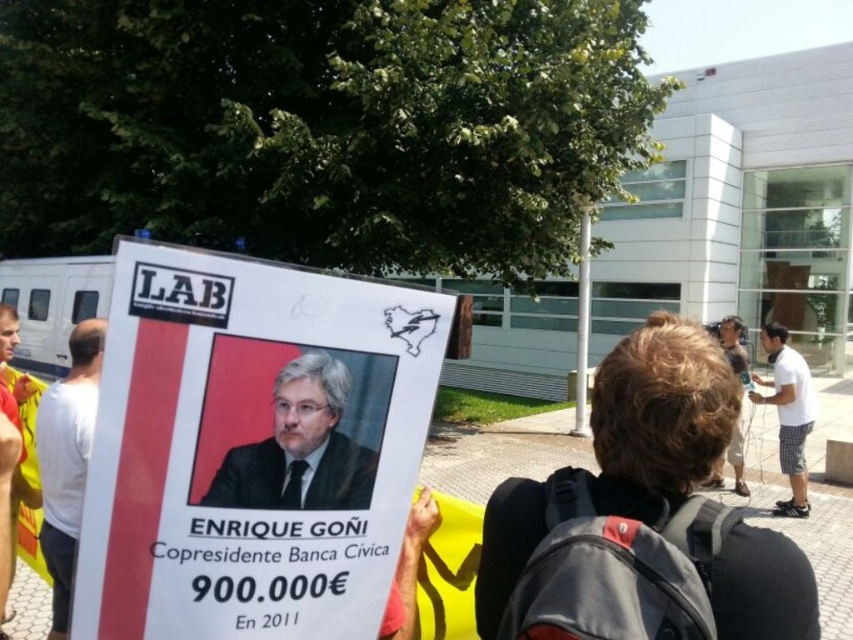
Question: Can you confirm if dark gray suit at center is positioned above white checkered shorts at lower right?

Choices:
 (A) yes
 (B) no

Answer: (A)

Question: Which object appears closest to the camera in this image?

Choices:
 (A) white t-shirt at left
 (B) white checkered shorts at lower right

Answer: (A)

Question: Does dark gray suit at center come in front of white t-shirt at left?

Choices:
 (A) yes
 (B) no

Answer: (A)

Question: Estimate the real-world distances between objects in this image. Which object is farther from the white t-shirt at left?

Choices:
 (A) dark gray suit at center
 (B) white checkered shorts at lower right

Answer: (B)

Question: Which object is the closest to the white paper poster at center?

Choices:
 (A) white t-shirt at left
 (B) dark gray suit at center

Answer: (B)

Question: Does white t-shirt at left appear under light brown hair at right?

Choices:
 (A) yes
 (B) no

Answer: (B)